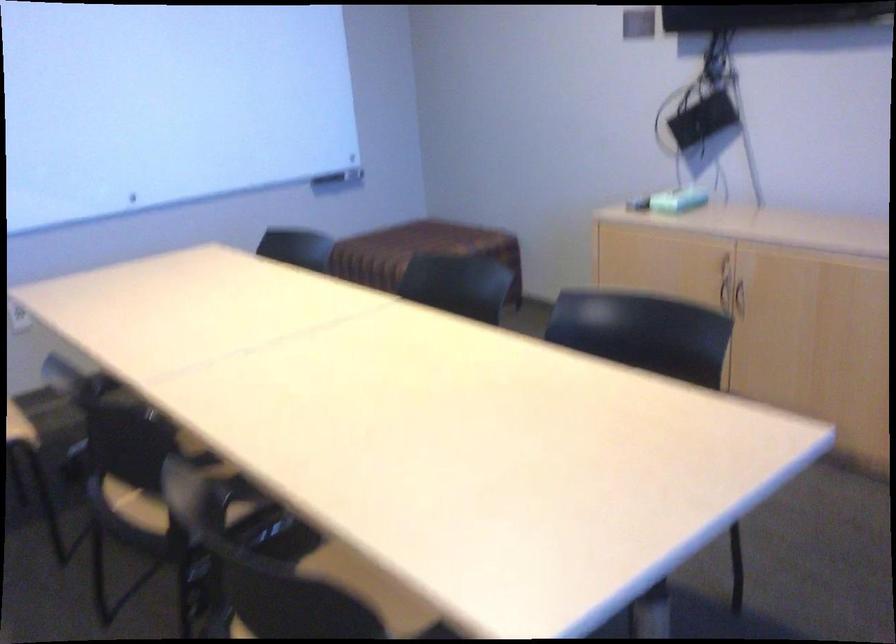
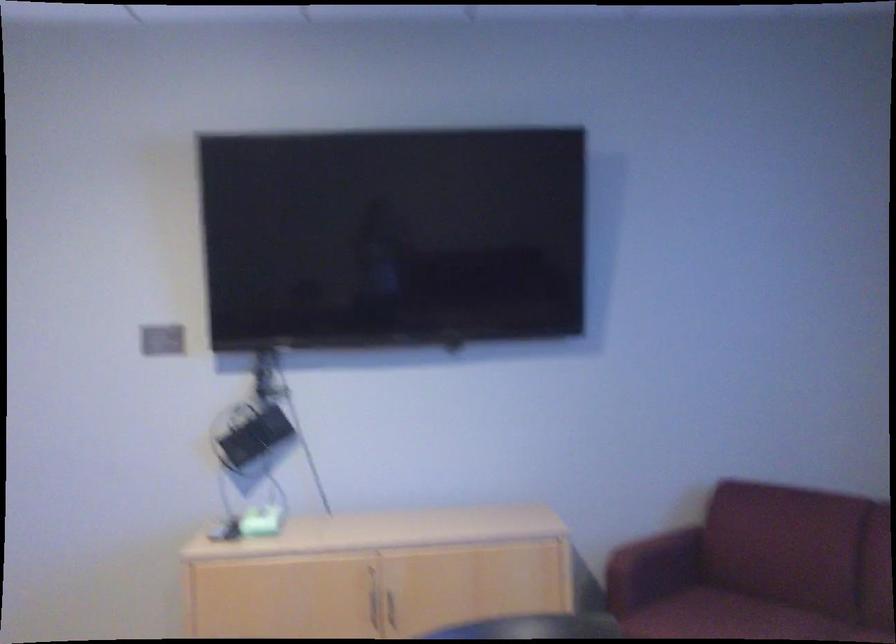
The point at (672,194) is marked in the first image. Where is the corresponding point in the second image?

(257, 522)